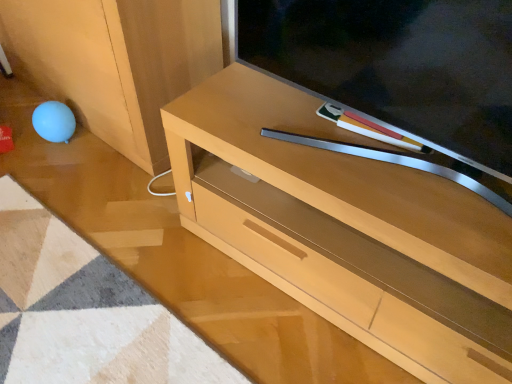
This screenshot has height=384, width=512. In order to click on matte wood television at center in this screenshot , I will do `click(401, 72)`.

Find the location of a particular element. Image resolution: width=512 pixels, height=384 pixels. light wood cabinet at lower right is located at coordinates (116, 62).

From a real-world perspective, between light brown wood tv stand at center and light wood cabinet at lower right, who is vertically lower?

light brown wood tv stand at center, from a real-world perspective.

Is light brown wood tv stand at center directly adjacent to light wood cabinet at lower right?

light brown wood tv stand at center and light wood cabinet at lower right are not in contact.

Looking at the image, does light brown wood tv stand at center seem bigger or smaller compared to light wood cabinet at lower right?

Considering their sizes, light brown wood tv stand at center takes up less space than light wood cabinet at lower right.

Is point (133, 47) farther from viewer compared to point (322, 239)?

Yes, it is.

Could you tell me if light wood cabinet at lower right is turned towards light brown wood tv stand at center?

No, light wood cabinet at lower right is not oriented towards light brown wood tv stand at center.

Between light wood cabinet at lower right and light brown wood tv stand at center, which one appears on the left side from the viewer's perspective?

Positioned to the left is light wood cabinet at lower right.

Which is in front, matte wood television at center or light brown wood tv stand at center?

matte wood television at center is closer to the camera.

Is matte wood television at center inside the boundaries of light brown wood tv stand at center, or outside?

matte wood television at center is not inside light brown wood tv stand at center, it's outside.

From the image's perspective, is matte wood television at center positioned above or below light brown wood tv stand at center?

matte wood television at center is situated higher than light brown wood tv stand at center in the image.

How many degrees apart are the facing directions of matte wood television at center and light brown wood tv stand at center?

The angular difference between matte wood television at center and light brown wood tv stand at center is 2.6 degrees.

Between light brown wood tv stand at center and matte wood television at center, which one has more height?

light brown wood tv stand at center is taller.

Which object is positioned more to the right, light brown wood tv stand at center or matte wood television at center?

Positioned to the right is light brown wood tv stand at center.

From the image's perspective, is light brown wood tv stand at center above matte wood television at center?

No, from the image's perspective, light brown wood tv stand at center is not over matte wood television at center.

How much distance is there between light brown wood tv stand at center and matte wood television at center?

8.60 inches.

Does point (106, 17) come farther from viewer compared to point (500, 106)?

Yes, point (106, 17) is farther from viewer.

Does light wood cabinet at lower right have a lesser width compared to matte wood television at center?

In fact, light wood cabinet at lower right might be wider than matte wood television at center.

Considering the sizes of objects light wood cabinet at lower right and matte wood television at center in the image provided, who is bigger, light wood cabinet at lower right or matte wood television at center?

light wood cabinet at lower right is bigger.

Between light wood cabinet at lower right and matte wood television at center, which one has less height?

matte wood television at center.

In the scene shown: Can you tell me how much matte wood television at center and light wood cabinet at lower right differ in facing direction?

matte wood television at center and light wood cabinet at lower right are facing 2.49 degrees away from each other.

In terms of size, does matte wood television at center appear bigger or smaller than light wood cabinet at lower right?

Considering their sizes, matte wood television at center takes up less space than light wood cabinet at lower right.

Is matte wood television at center not close to light wood cabinet at lower right?

matte wood television at center is near light wood cabinet at lower right, not far away.

Is matte wood television at center further to the viewer compared to light wood cabinet at lower right?

No, it is not.

This screenshot has height=384, width=512. In order to click on cabinetry located on the left of light brown wood tv stand at center in this screenshot , I will do `click(116, 62)`.

Image resolution: width=512 pixels, height=384 pixels. There is a light brown wood tv stand at center. In order to click on cabinetry above it (from a real-world perspective) in this screenshot , I will do `click(116, 62)`.

From the picture: Estimate the real-world distances between objects in this image. Which object is closer to matte wood television at center, light brown wood tv stand at center or light wood cabinet at lower right?

The object closer to matte wood television at center is light brown wood tv stand at center.

In the scene shown: When comparing their distances from light wood cabinet at lower right, does matte wood television at center or light brown wood tv stand at center seem closer?

Among the two, light brown wood tv stand at center is located nearer to light wood cabinet at lower right.

Considering their positions, is light wood cabinet at lower right positioned closer to matte wood television at center than light brown wood tv stand at center?

light brown wood tv stand at center.

When comparing their distances from light brown wood tv stand at center, does light wood cabinet at lower right or matte wood television at center seem further?

light wood cabinet at lower right lies further to light brown wood tv stand at center than the other object.

When comparing their distances from light wood cabinet at lower right, does light brown wood tv stand at center or matte wood television at center seem further?

Based on the image, matte wood television at center appears to be further to light wood cabinet at lower right.

Looking at the image, which one is located closer to light brown wood tv stand at center, matte wood television at center or light wood cabinet at lower right?

matte wood television at center.

Identify the location of television between light wood cabinet at lower right and light brown wood tv stand at center in the horizontal direction. (401, 72).